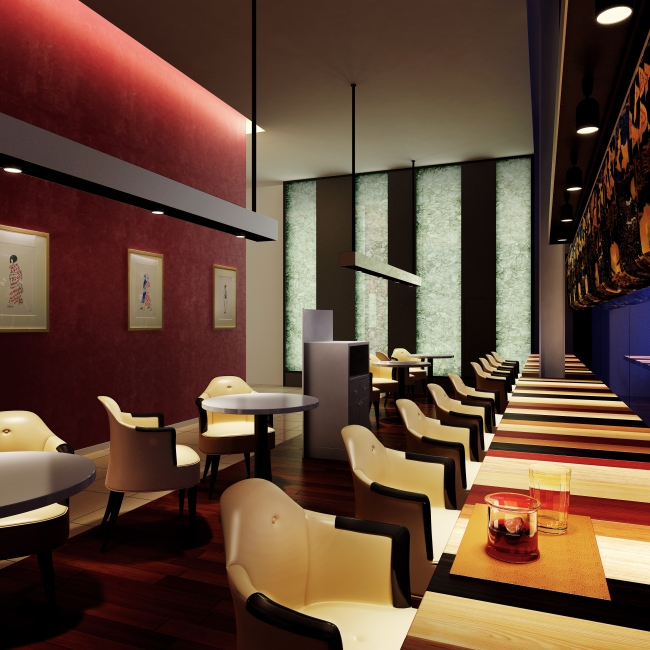
The width and height of the screenshot is (650, 650). In order to click on mirror in this screenshot , I will do `click(585, 353)`.